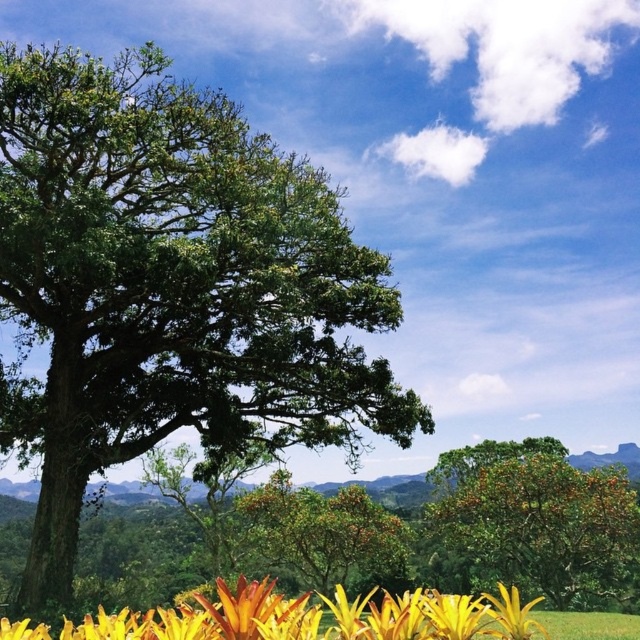
You are a gardener planning to plant a new flower bed between the green leafy oak tree at left and the yellow matte flower at lower center. Considering their sizes, which object will require more space horizontally for proper growth?

The green leafy oak tree at left requires more horizontal space because its width is larger than the yellow matte flower at lower center.